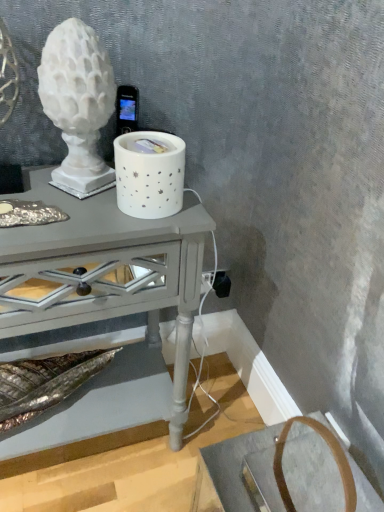
Identify the location of vacant point to the left of white matte sculpture at upper left, the first candle holder when ordered from left to right. This screenshot has height=512, width=384. (27, 188).